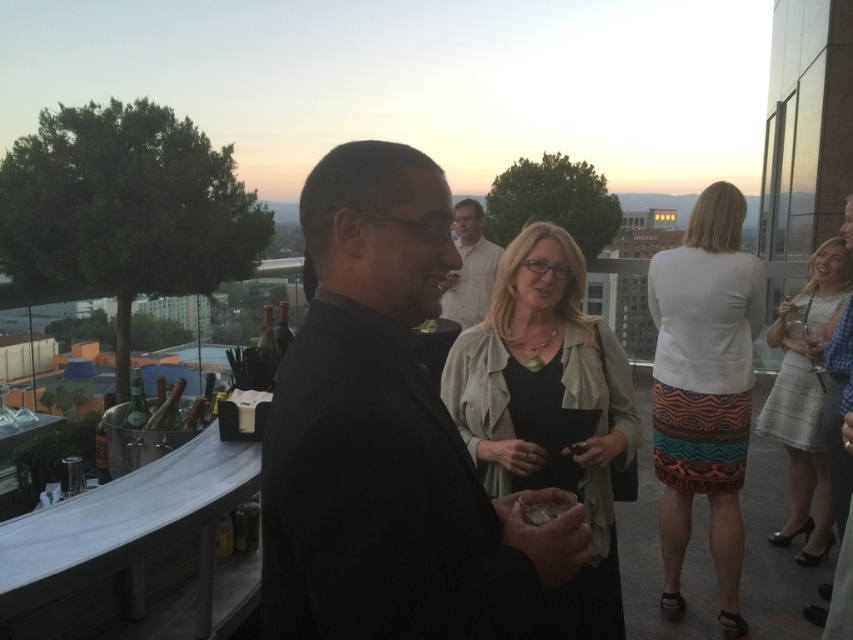
Who is more distant from viewer, (410, 278) or (741, 621)?

The point (741, 621) is behind.

Where is `black matte suit at center`? The height and width of the screenshot is (640, 853). black matte suit at center is located at coordinates (387, 436).

Between black matte suit at center and light gray textured skirt at right, which one is positioned lower?

Positioned lower is light gray textured skirt at right.

Who is higher up, black matte suit at center or light gray textured skirt at right?

Positioned higher is black matte suit at center.

Identify the location of black matte suit at center. The width and height of the screenshot is (853, 640). (387, 436).

Does black matte suit at center have a lesser width compared to matte beige jacket at center?

Correct, black matte suit at center's width is less than matte beige jacket at center's.

Is black matte suit at center shorter than matte beige jacket at center?

Correct, black matte suit at center is not as tall as matte beige jacket at center.

Does point (296, 353) come farther from viewer compared to point (479, 442)?

That is False.

Locate an element on the screen. The image size is (853, 640). black matte suit at center is located at coordinates (387, 436).